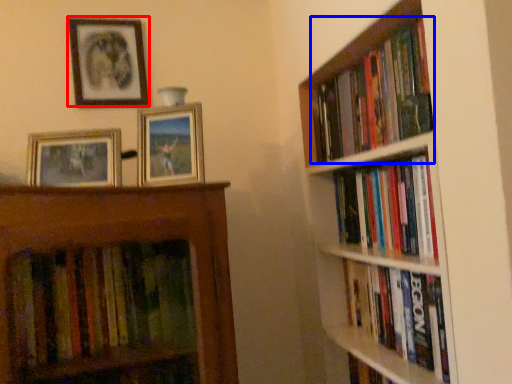
Question: Which of the following is the farthest to the observer, picture frame (highlighted by a red box) or book (highlighted by a blue box)?

Choices:
 (A) picture frame
 (B) book

Answer: (A)